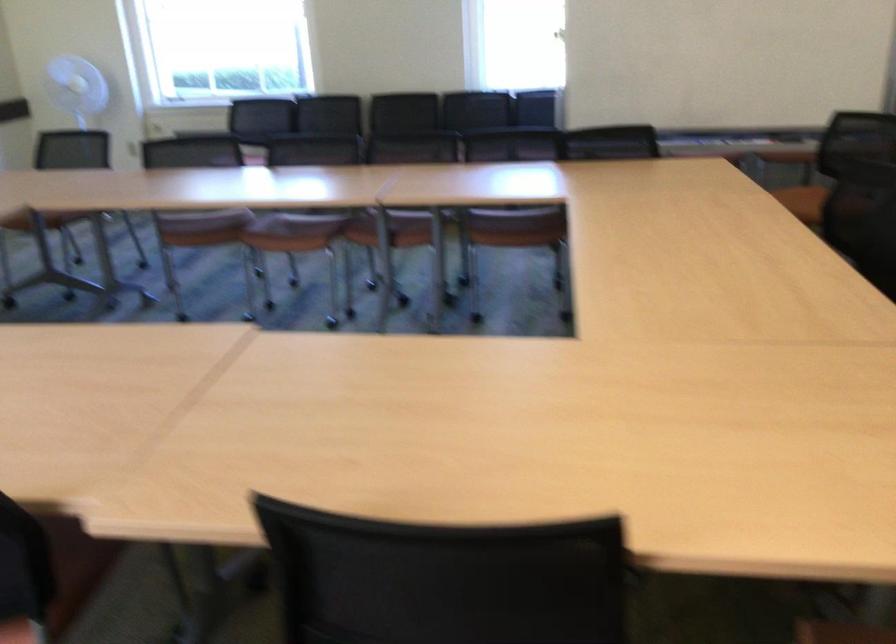
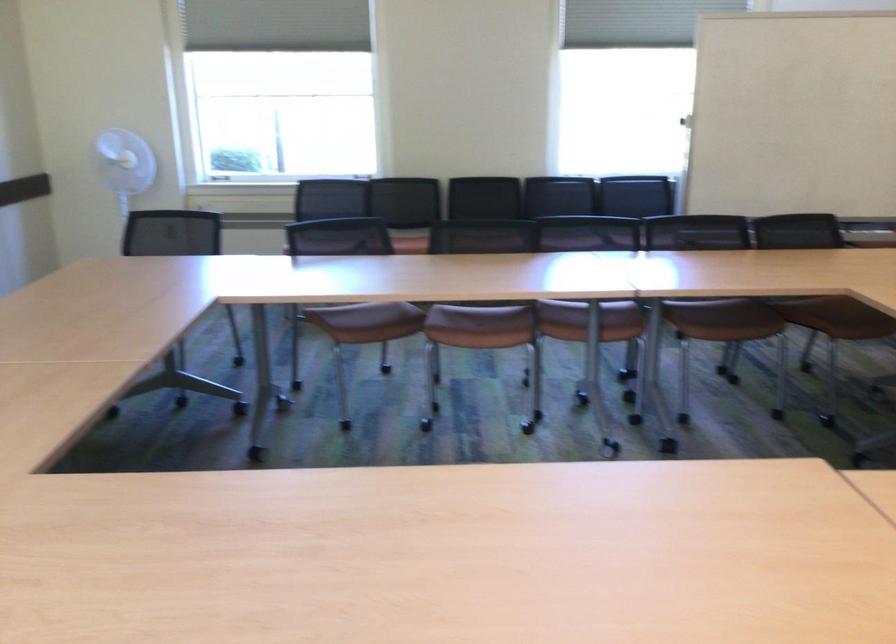
Locate, in the second image, the point that corresponds to (x=346, y=194) in the first image.

(590, 292)